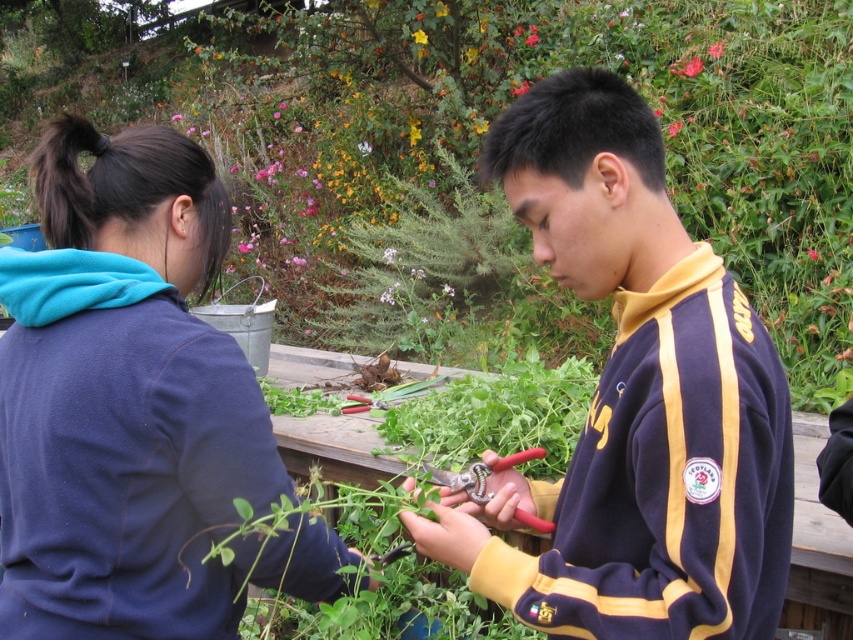
Question: Which of the following is the farthest from the observer?

Choices:
 (A) smooth yellow flower at center
 (B) purple/yellow sweatshirt at center

Answer: (A)

Question: Among these objects, which one is farthest from the camera?

Choices:
 (A) glossy ceramic flower at upper center
 (B) purple/yellow sweatshirt at center
 (C) smooth yellow flower at center
 (D) dark blue fleece at upper left

Answer: (C)

Question: Is dark blue fleece at upper left in front of purple/yellow sweatshirt at center?

Choices:
 (A) no
 (B) yes

Answer: (A)

Question: Which point is closer to the camera?

Choices:
 (A) dark blue fleece at upper left
 (B) smooth yellow flower at center
 (C) glossy ceramic flower at upper center
 (D) purple/yellow sweatshirt at center

Answer: (D)

Question: Does dark blue fleece at upper left appear over purple/yellow sweatshirt at center?

Choices:
 (A) no
 (B) yes

Answer: (A)

Question: Is dark blue fleece at upper left thinner than purple/yellow sweatshirt at center?

Choices:
 (A) yes
 (B) no

Answer: (B)